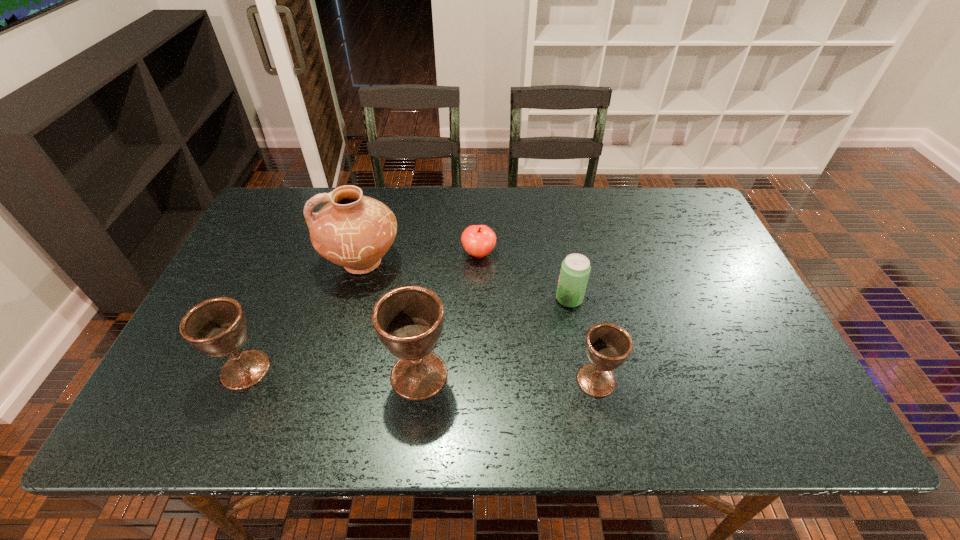
Identify the location of free space at the near edge of the desktop. This screenshot has width=960, height=540. (570, 375).

Image resolution: width=960 pixels, height=540 pixels. Find the location of `blank space at the left edge of the desktop`. blank space at the left edge of the desktop is located at coordinates (201, 355).

Where is `vacant area at the right edge`? The width and height of the screenshot is (960, 540). vacant area at the right edge is located at coordinates (706, 273).

Where is `free spot at the far left corner of the desktop`? This screenshot has height=540, width=960. free spot at the far left corner of the desktop is located at coordinates (287, 195).

Identify the location of free region at the far right corner of the desktop. (693, 222).

Locate an element on the screen. free space that is in between the apple and the rightmost chalice is located at coordinates (538, 317).

Where is `vacant point located between the soda and the fifth object from right to left`? The image size is (960, 540). vacant point located between the soda and the fifth object from right to left is located at coordinates (466, 281).

Locate an element on the screen. free point between the shortest object and the shortest chalice is located at coordinates (538, 317).

You are a GUI agent. You are given a task and a screenshot of the screen. Output one action in this format:
    pyautogui.click(x=<x>, y=<y>)
    Task: Click on the vacant point located between the tallest chalice and the leftmost chalice
    The image size is (960, 540).
    Given the screenshot: What is the action you would take?
    pyautogui.click(x=332, y=372)

Where is `free space that is in between the soda and the rightmost chalice`? free space that is in between the soda and the rightmost chalice is located at coordinates (583, 340).